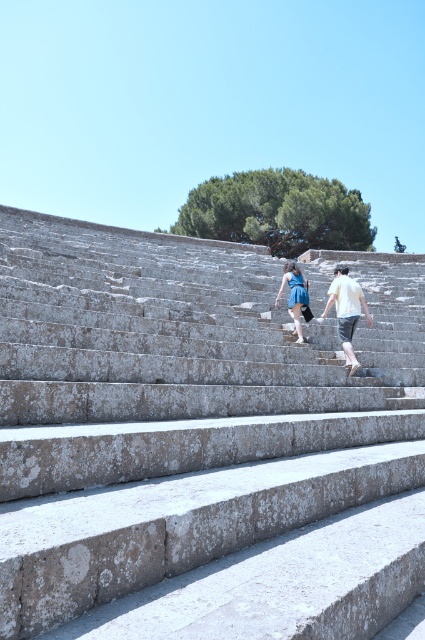
Who is lower down, white cotton shirt at center or blue denim dress at center?

Positioned lower is white cotton shirt at center.

Is point (339, 330) farther from camera compared to point (303, 280)?

No, it is not.

Where is `white cotton shirt at center`? white cotton shirt at center is located at coordinates (346, 310).

Which of these two, gray stone steps at center or blue denim dress at center, stands taller?

gray stone steps at center is taller.

Does gray stone steps at center appear on the left side of blue denim dress at center?

Correct, you'll find gray stone steps at center to the left of blue denim dress at center.

Does point (422, 314) come farther from viewer compared to point (295, 284)?

Yes, point (422, 314) is farther from viewer.

At what (x,y) coordinates should I click in order to perform the action: click on gray stone steps at center. Please return your answer as a coordinate pair (x, y). The width and height of the screenshot is (425, 640). Looking at the image, I should click on (203, 442).

Is gray stone steps at center to the right of white cotton shirt at center from the viewer's perspective?

→ No, gray stone steps at center is not to the right of white cotton shirt at center.

Can you confirm if gray stone steps at center is bigger than white cotton shirt at center?

Yes.

Is point (356, 413) more distant than point (356, 362)?

That is False.

Where is `gray stone steps at center`? The height and width of the screenshot is (640, 425). gray stone steps at center is located at coordinates (203, 442).